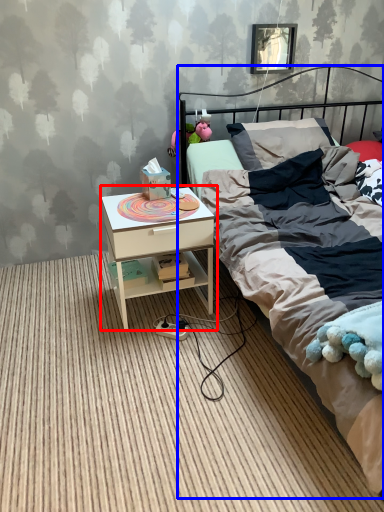
Question: Which of the following is the farthest to the observer, nightstand (highlighted by a red box) or bed (highlighted by a blue box)?

Choices:
 (A) nightstand
 (B) bed

Answer: (A)